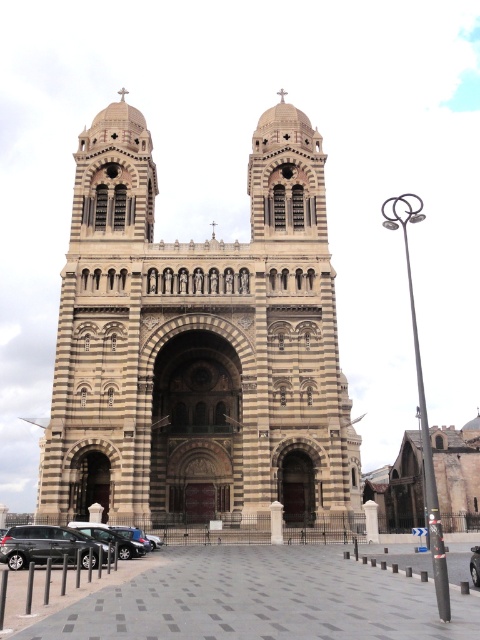
Question: Which point is farther to the camera?

Choices:
 (A) (68, 378)
 (B) (29, 529)
 (C) (122, 552)
 (D) (132, 534)

Answer: (A)

Question: Can you confirm if metallic silver car at lower left is bigger than metallic gray car at lower left?

Choices:
 (A) yes
 (B) no

Answer: (A)

Question: Considering the real-world distances, which object is farthest from the metallic gray car at lower left?

Choices:
 (A) brown stone tower at center
 (B) metallic silver car at lower left
 (C) shiny black sedan at lower left

Answer: (A)

Question: Which of the following is the farthest from the observer?

Choices:
 (A) (144, 538)
 (B) (139, 547)
 (C) (168, 272)

Answer: (C)

Question: From the image, what is the correct spatial relationship of metallic silver car at lower left in relation to shiny black sedan at lower left?

Choices:
 (A) right
 (B) left

Answer: (B)

Question: Is brown stone tower at center to the left of metallic gray car at lower left from the viewer's perspective?

Choices:
 (A) yes
 (B) no

Answer: (A)